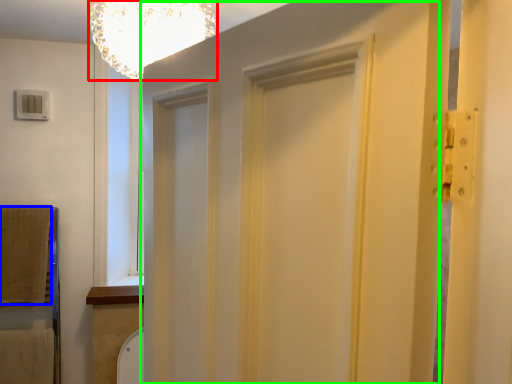
Question: Based on their relative distances, which object is farther from light fixture (highlighted by a red box)? Choose from blanket (highlighted by a blue box) and barn door (highlighted by a green box).

Choices:
 (A) blanket
 (B) barn door

Answer: (A)